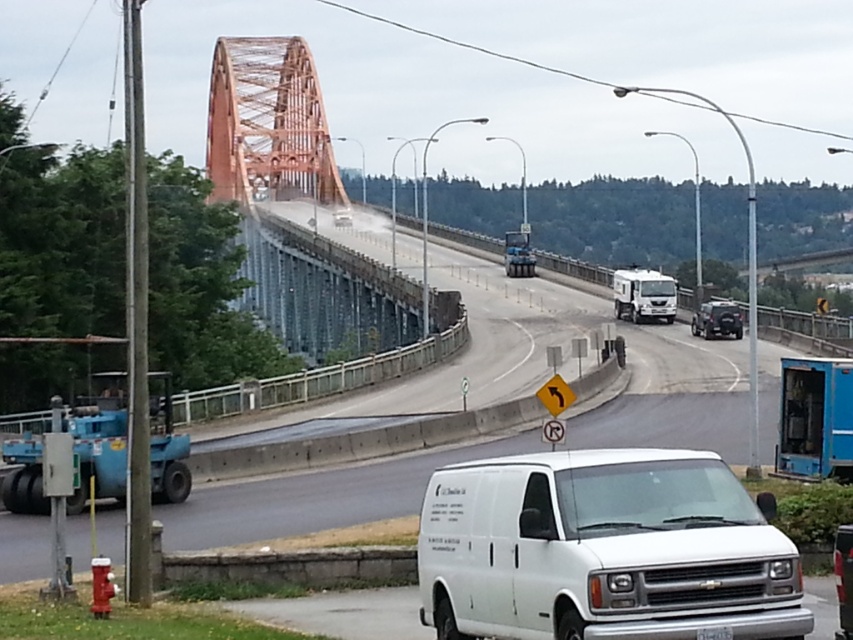
You are a delivery driver who needs to park your vehicle on the highway near the orange bridge. You see the blue metallic trailer truck at right. Based on its position, where should you park your vehicle to ensure it doesn not block the road? Please provide coordinates in the format of a point between 0 and 1 in both x and y axes.

The blue metallic trailer truck at right is located at point (815, 419). To park without blocking the road, you should choose a spot away from this position, such as near point (767, 192).

You are a driver approaching the arched bridge and see the shiny black car at center and the blue metallic truck at center ahead. Which vehicle will you pass first?

The shiny black car at center is shorter than the blue metallic truck at center, so you will pass the shiny black car at center first because it is closer to your current position.